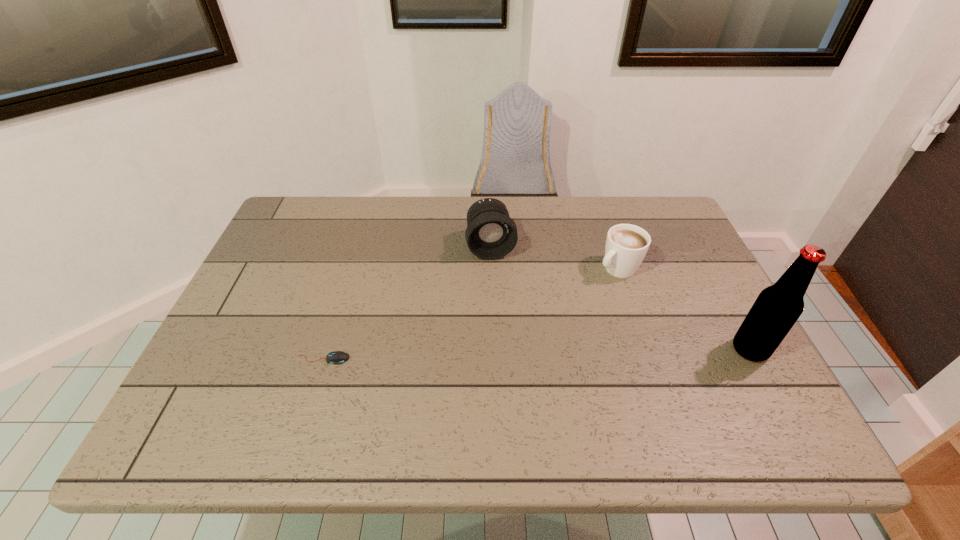
I want to click on vacant region located 0.150m at the front element of the third object from right to left, so click(501, 301).

Find the location of a particular element. vacant region located 0.120m at the front element of the third object from right to left is located at coordinates (500, 293).

The image size is (960, 540). Find the location of `vacant space located 0.270m at the front element of the third object from right to left`. vacant space located 0.270m at the front element of the third object from right to left is located at coordinates (509, 338).

At what (x,y) coordinates should I click in order to perform the action: click on free spot located with the handle on the side of the third object from left to right. Please return your answer as a coordinate pair (x, y). This screenshot has width=960, height=540. Looking at the image, I should click on (557, 310).

What are the coordinates of `vacant space located with the handle on the side of the third object from left to right` in the screenshot? It's located at (511, 342).

I want to click on vacant space located 0.050m with the handle on the side of the third object from left to right, so click(590, 286).

Where is `object at the far edge`? object at the far edge is located at coordinates (490, 234).

The height and width of the screenshot is (540, 960). Find the location of `object that is at the right edge`. object that is at the right edge is located at coordinates (777, 308).

You are a GUI agent. You are given a task and a screenshot of the screen. Output one action in this format:
    pyautogui.click(x=<x>, y=<y>)
    Task: Click on the vacant space at the far edge
    Image resolution: width=960 pixels, height=540 pixels.
    Given the screenshot: What is the action you would take?
    pyautogui.click(x=350, y=221)

Where is `vacant region at the near edge of the desktop`? The height and width of the screenshot is (540, 960). vacant region at the near edge of the desktop is located at coordinates (411, 375).